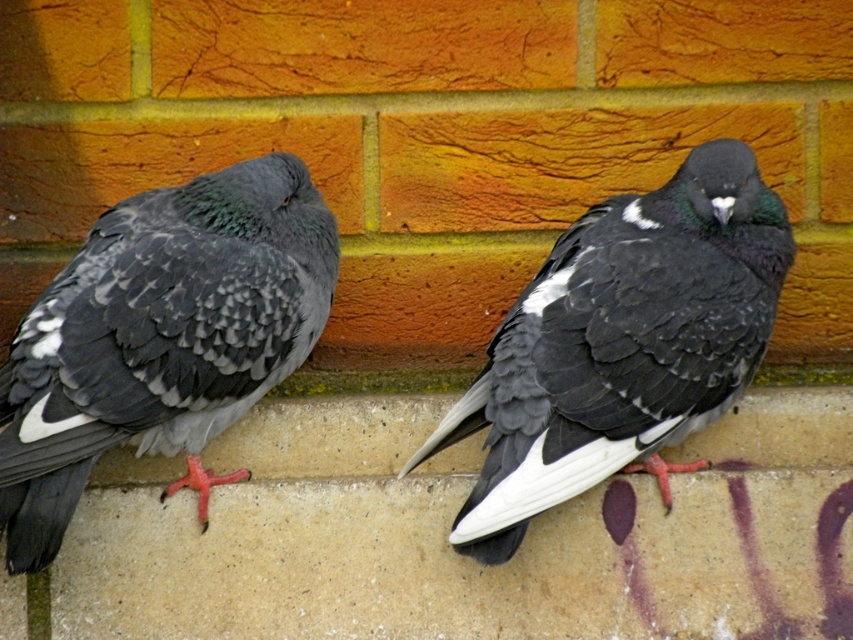
Question: Which point appears farthest from the camera in this image?

Choices:
 (A) (373, 513)
 (B) (630, 211)
 (C) (285, 276)

Answer: (A)

Question: Among these objects, which one is nearest to the camera?

Choices:
 (A) concreteroughpigeons at lower center
 (B) black matte pigeon at center

Answer: (B)

Question: Is matte gray pigeon at center positioned behind black matte pigeon at center?

Choices:
 (A) yes
 (B) no

Answer: (B)

Question: Which object is positioned closest to the concreteroughpigeons at lower center?

Choices:
 (A) matte gray pigeon at center
 (B) black matte pigeon at center

Answer: (B)

Question: Does concreteroughpigeons at lower center have a larger size compared to matte gray pigeon at center?

Choices:
 (A) no
 (B) yes

Answer: (B)

Question: Is concreteroughpigeons at lower center wider than black matte pigeon at center?

Choices:
 (A) yes
 (B) no

Answer: (A)